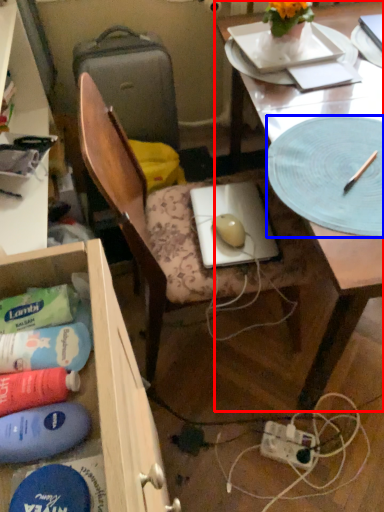
Question: Which object is further to the camera taking this photo, desk (highlighted by a red box) or platter (highlighted by a blue box)?

Choices:
 (A) desk
 (B) platter

Answer: (B)